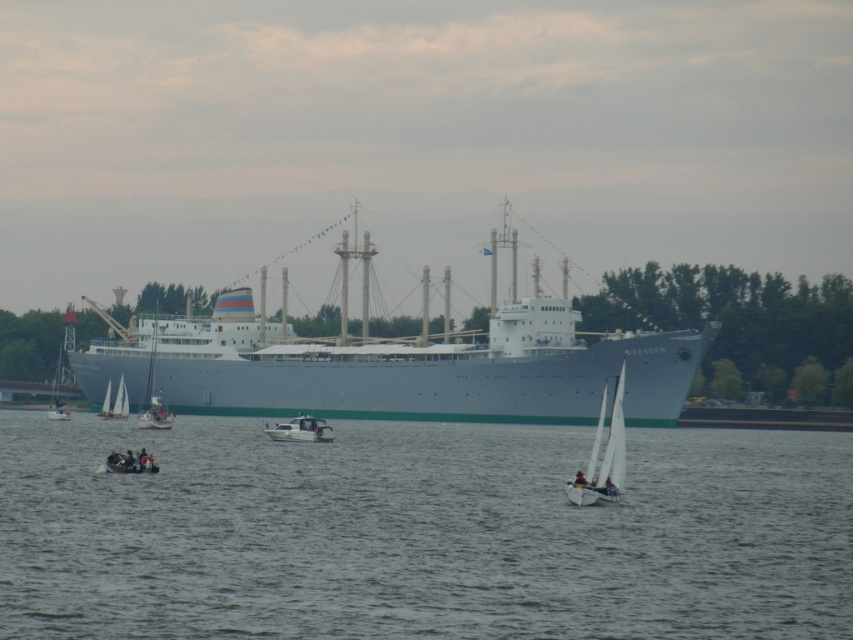
You are a passenger on the Dresden ship and you want to know which of the two boats, the white matte sailboat at center or the white plastic boat at lower left, is taller. Can you tell me?

The white matte sailboat at center is taller than the white plastic boat at lower left according to the description.